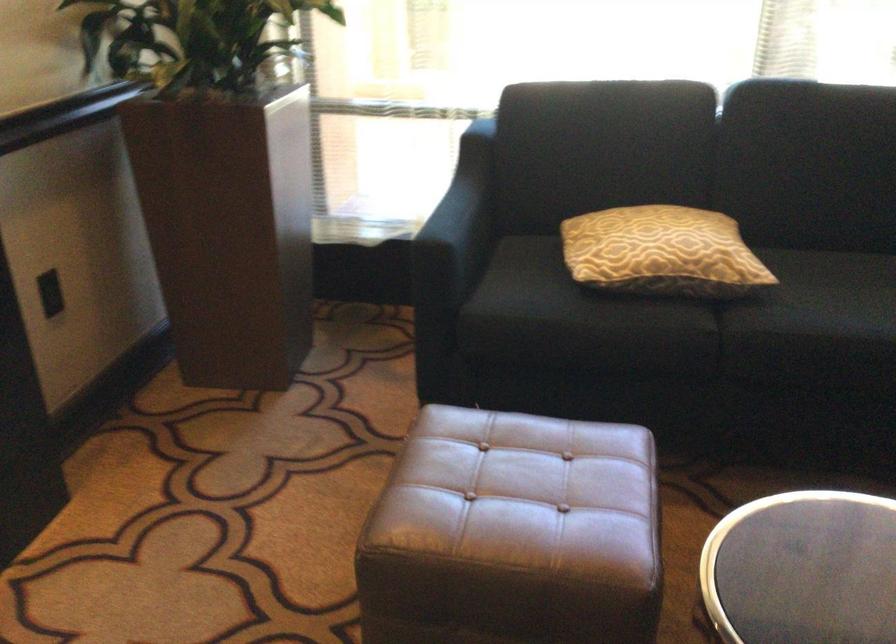
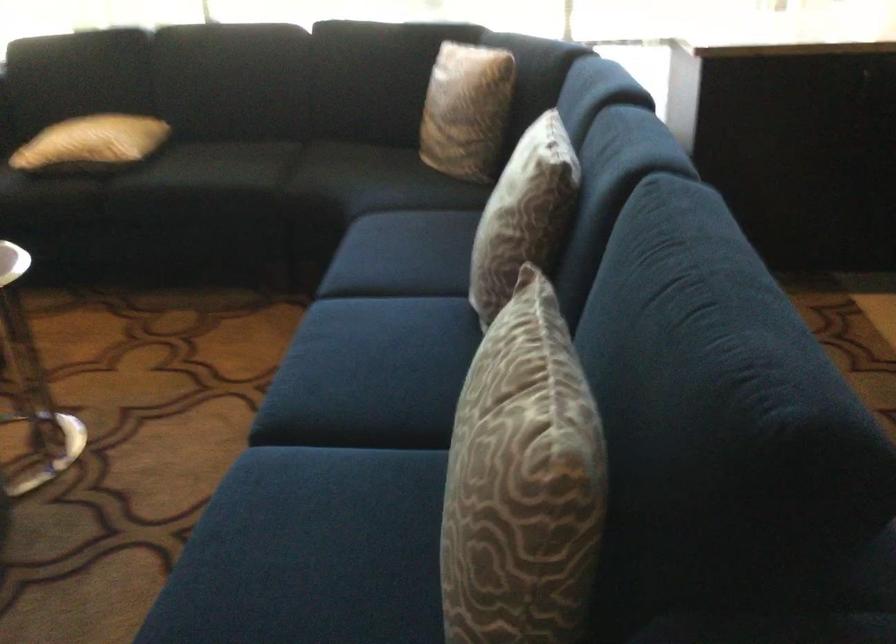
Where in the second image is the point corresponding to point 702,254 from the first image?

(91, 142)